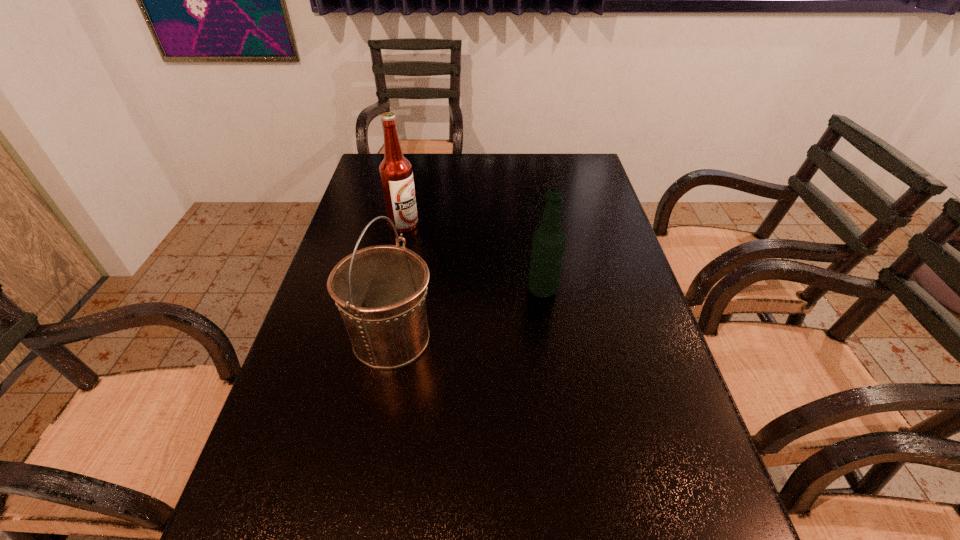
The image size is (960, 540). I want to click on free space at the far edge, so click(x=525, y=173).

The image size is (960, 540). What are the coordinates of `vacant space at the left edge` in the screenshot? It's located at (296, 481).

Where is `free space at the right edge`? Image resolution: width=960 pixels, height=540 pixels. free space at the right edge is located at coordinates (568, 211).

The height and width of the screenshot is (540, 960). In the image, there is a desktop. What are the coordinates of `vacant space at the far right corner` in the screenshot? It's located at click(547, 153).

Identify the location of free space between the bucket and the right alcohol. (468, 314).

This screenshot has height=540, width=960. What are the coordinates of `vacant area that lies between the right alcohol and the bucket` in the screenshot? It's located at (468, 314).

Identify which object is the closest to the second farthest object. Please provide its 2D coordinates. Your answer should be formatted as a tuple, i.e. [(x, y)], where the tuple contains the x and y coordinates of a point satisfying the conditions above.

[(380, 291)]

Where is `object that is the second closest to the left alcohol`? This screenshot has width=960, height=540. object that is the second closest to the left alcohol is located at coordinates (548, 242).

You are a GUI agent. You are given a task and a screenshot of the screen. Output one action in this format:
    pyautogui.click(x=<x>, y=<y>)
    Task: Click on the vacant area in the image that satisfies the following two spatial constraints: 1. on the label side of the farther alcohol; 2. on the back side of the bucket
    
    Given the screenshot: What is the action you would take?
    pyautogui.click(x=379, y=339)

Identify the location of free location that satisfies the following two spatial constraints: 1. on the label side of the left alcohol; 2. on the left side of the nearer alcohol. The image size is (960, 540). (390, 291).